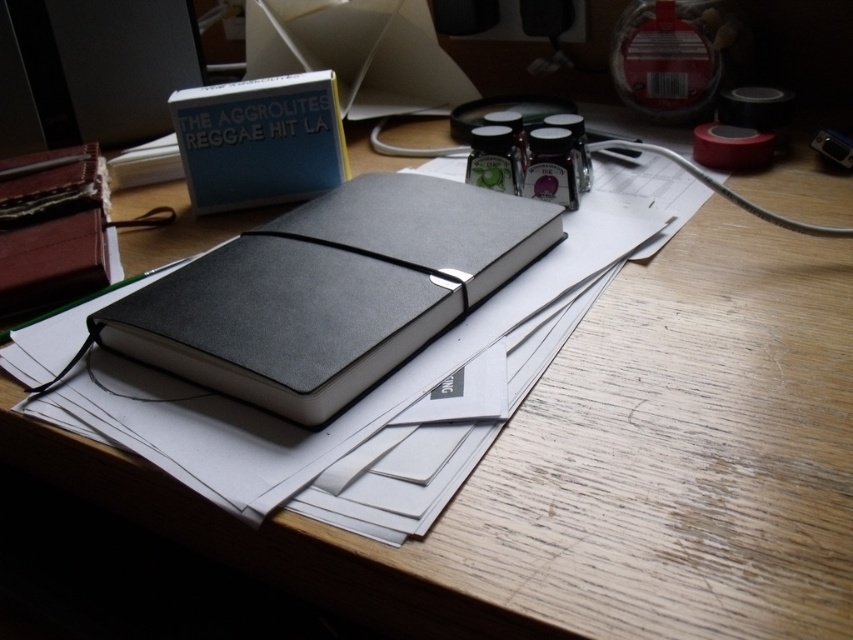
Who is lower down, matte black notebook at center or matte black notebook at upper left?

Positioned lower is matte black notebook at center.

Is matte black notebook at center below matte black notebook at upper left?

Yes, matte black notebook at center is below matte black notebook at upper left.

Where is `matte black notebook at center`? The height and width of the screenshot is (640, 853). matte black notebook at center is located at coordinates (329, 291).